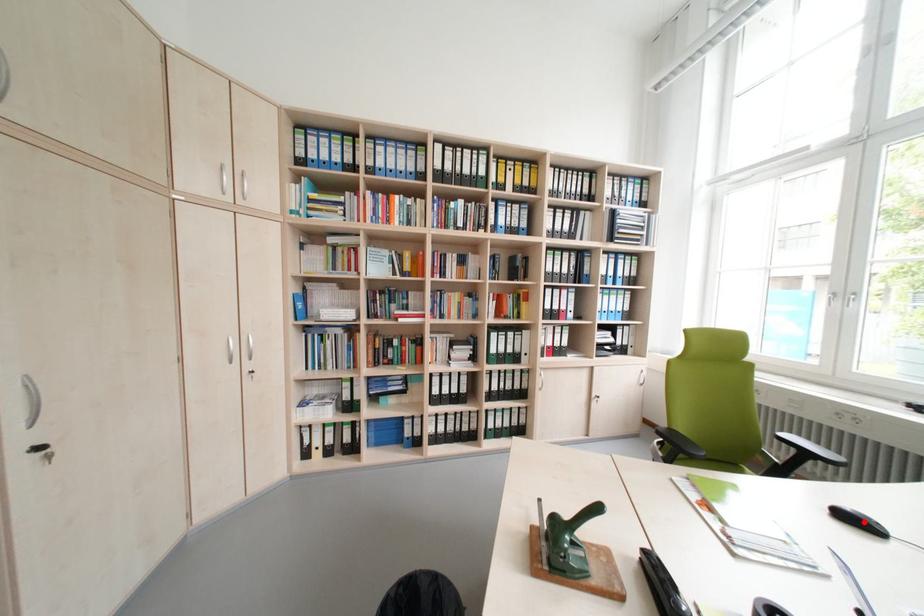
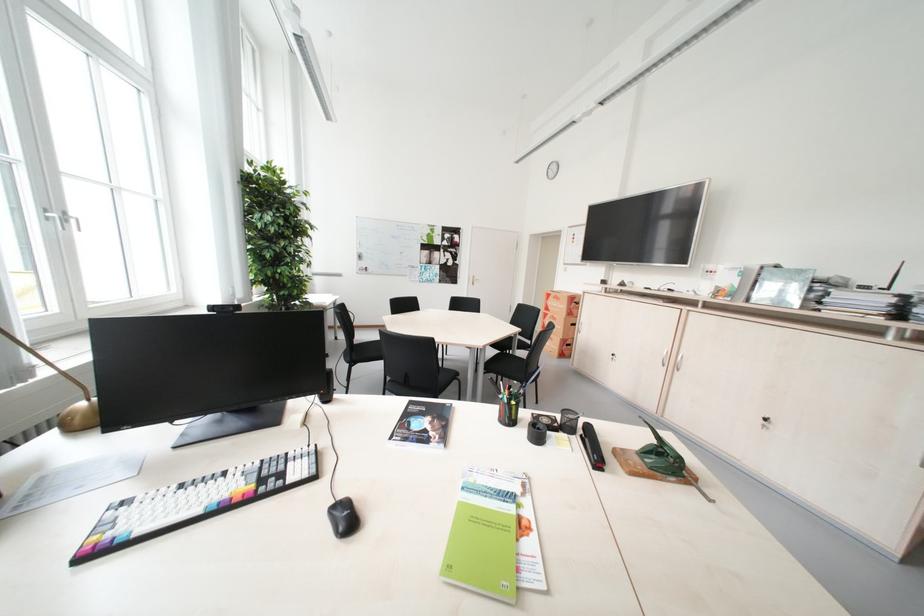
Find the pixel in the second image that matches the highlighted location in the first image.

(359, 521)